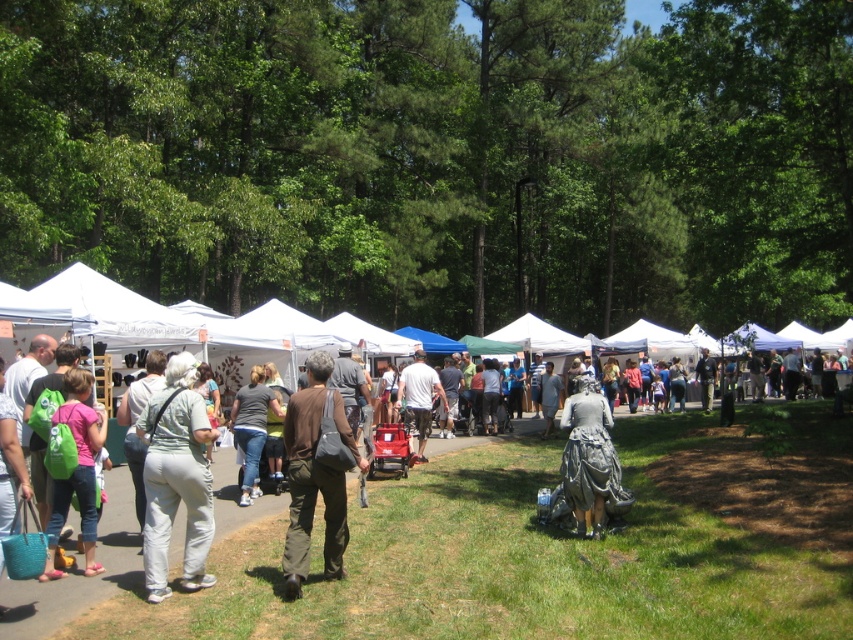
You are a photographer at the event and want to take a photo of both the light gray pants at center and the brown cotton shirt at center. Since you can only focus on one subject at a time, which one should you focus on to ensure the other appears in the background?

You should focus on the light gray pants at center because it is in front of the brown cotton shirt at center, so the brown cotton shirt at center will naturally appear in the background when the light gray pants at center is in focus.

You are a photographer at the event and want to take a photo of the brown cotton shirt at center and denim pants at center in the same frame. Given that your camera has a maximum focus range of 4 meters, will both items be in focus?

The brown cotton shirt at center and denim pants at center are 4.43 meters apart from each other. Since the distance between them exceeds the camera focus range of 4 meters, they might not both be in focus simultaneously.